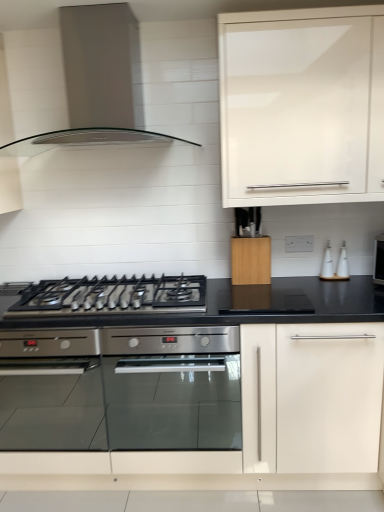
At what (x,y) coordinates should I click in order to perform the action: click on empty space that is ontop of black matte gas stove at center (from a real-world perspective). Please return your answer as a coordinate pair (x, y). This screenshot has height=512, width=384. Looking at the image, I should click on (130, 284).